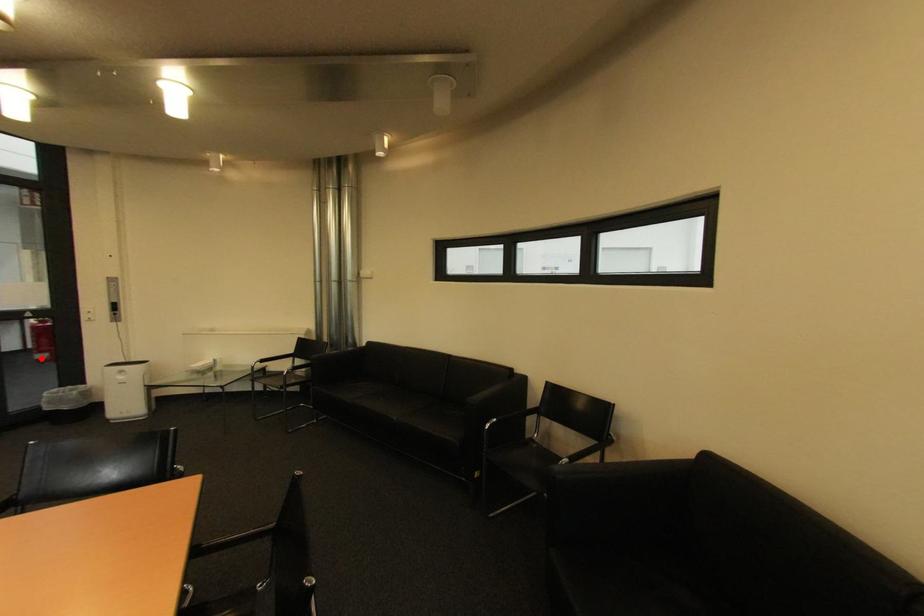
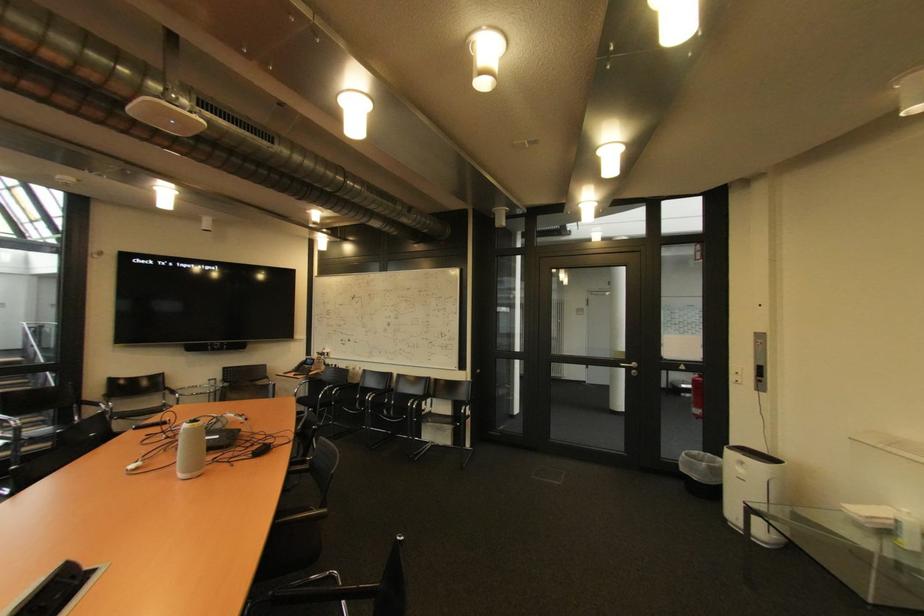
Question: A red point is marked in image1. In image2, is the corresponding 3D point closer to the camera or farther? Reply with the corresponding letter.

Choices:
 (A) The corresponding 3D point is closer.
 (B) The corresponding 3D point is farther.

Answer: (A)